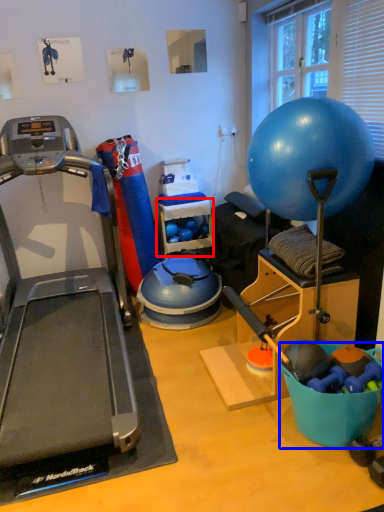
Question: Which object appears farthest to the camera in this image, shelf (highlighted by a red box) or bowl (highlighted by a blue box)?

Choices:
 (A) shelf
 (B) bowl

Answer: (A)